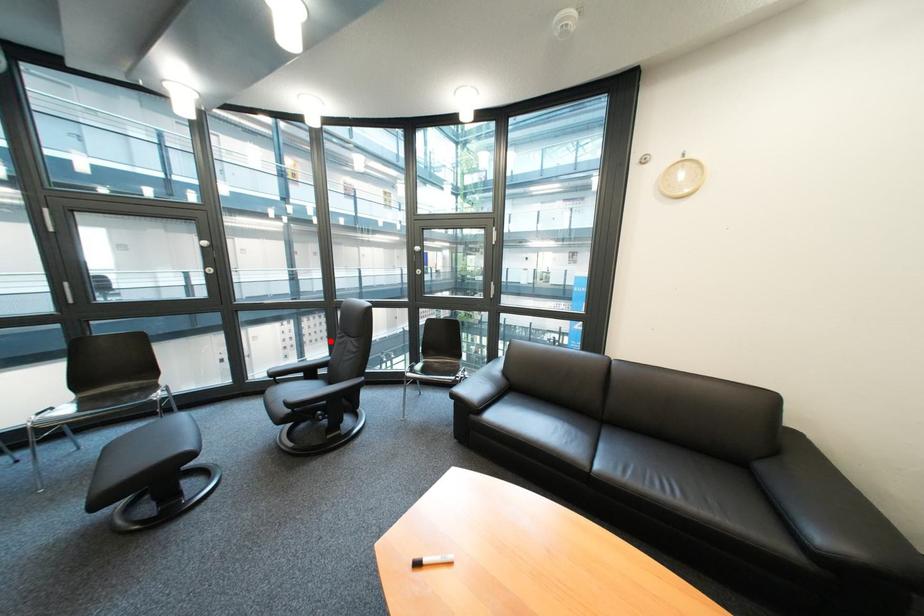
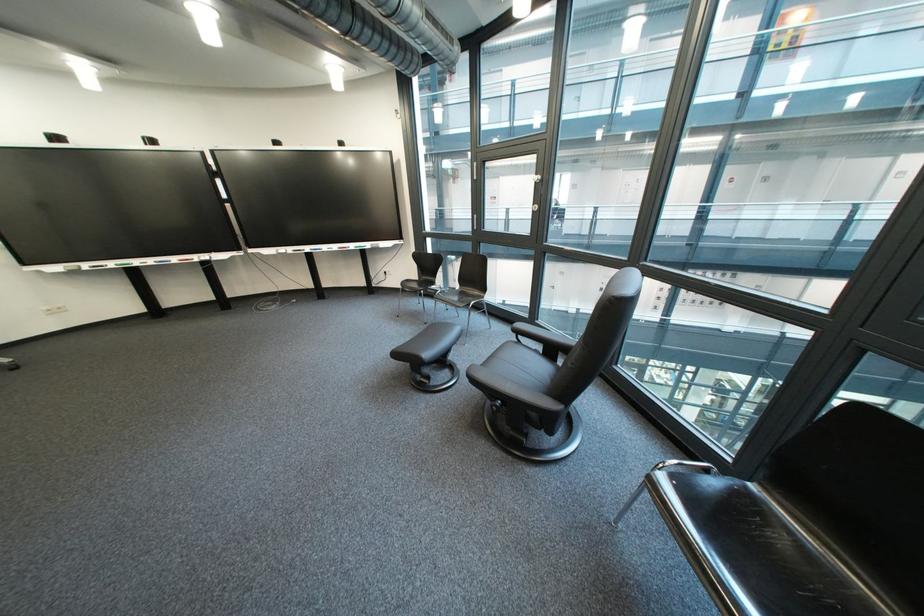
Find the pixel in the second image that matches the highlighted location in the first image.

(715, 304)